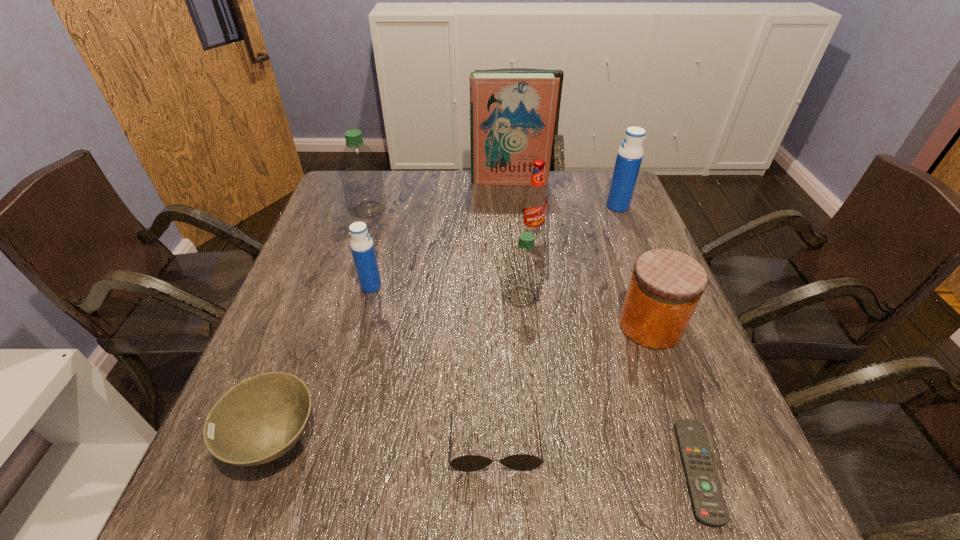
Identify the location of the farthest object. (512, 114).

Identify the location of the tallest object. (512, 114).

Locate an element on the screen. the bigger blue water bottle is located at coordinates (629, 157).

Locate an element on the screen. the rightmost water bottle is located at coordinates (629, 157).

Where is `the bigger green water bottle`? This screenshot has height=540, width=960. the bigger green water bottle is located at coordinates (360, 172).

Where is `the farther green water bottle`? The height and width of the screenshot is (540, 960). the farther green water bottle is located at coordinates (360, 172).

Where is `root beer`? The height and width of the screenshot is (540, 960). root beer is located at coordinates (535, 201).

What are the coordinates of `red root beer` in the screenshot? It's located at pos(535,201).

Locate an element on the screen. the left blue water bottle is located at coordinates (361, 244).

Find the location of a particular element. This screenshot has width=960, height=540. the smaller blue water bottle is located at coordinates (361, 244).